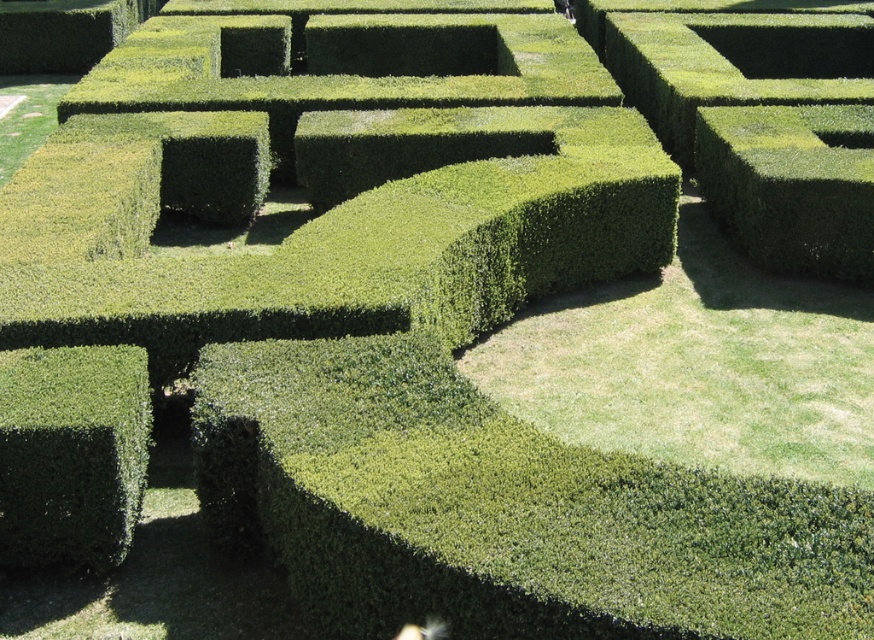
Question: From the image, what is the correct spatial relationship of green textured hedge at lower left in relation to green textured hedge at upper right?

Choices:
 (A) below
 (B) above

Answer: (A)

Question: Which object is farther from the camera taking this photo?

Choices:
 (A) green textured hedge at upper right
 (B) green textured hedge at lower left

Answer: (A)

Question: Can you confirm if green textured hedge at lower left is positioned to the left of green textured hedge at upper right?

Choices:
 (A) yes
 (B) no

Answer: (A)

Question: Can you confirm if green textured hedge at lower left is wider than green textured hedge at upper right?

Choices:
 (A) yes
 (B) no

Answer: (B)